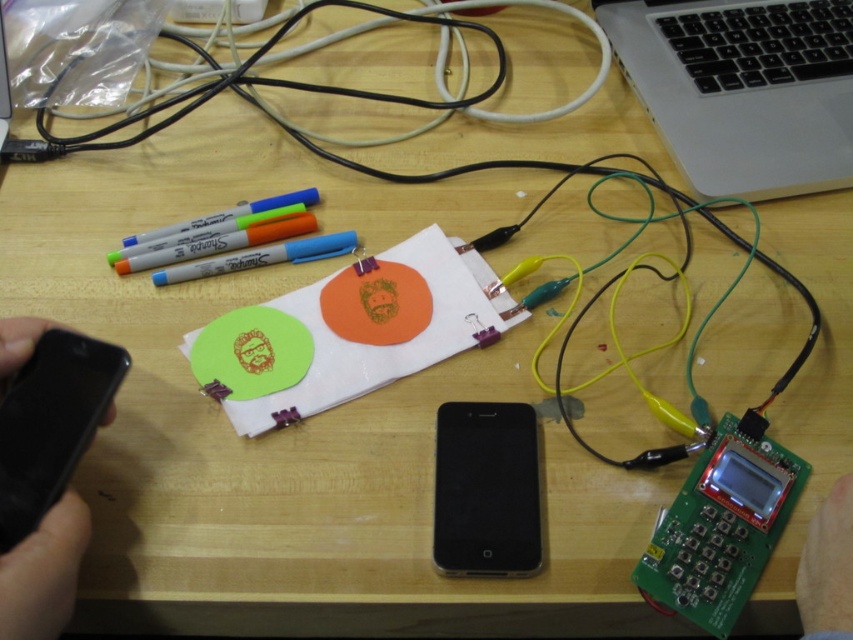
You are a technician who needs to connect two devices. You have a 20 cm long cable. You see the black matte smartphone at center and the black matte phone at left. Can the cable reach between them?

The distance between the black matte smartphone at center and the black matte phone at left is 21.31 centimeters. Since the cable is only 20 cm long, it is 1.31 cm too short to connect them.

You are setting up a project on the desk and need to connect two devices. You have a black matte smartphone at center and a black matte phone at left. Which device is positioned lower on the desk?

The black matte smartphone at center is below the black matte phone at left, so it is positioned lower on the desk.